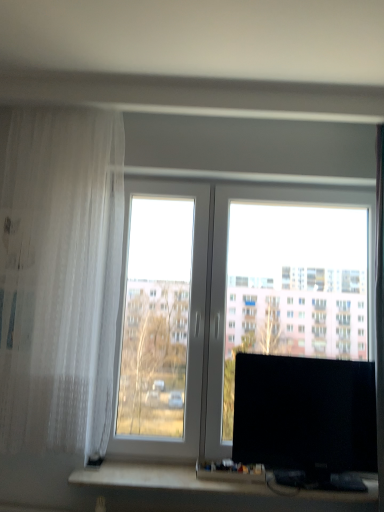
Describe the element at coordinates (59, 277) in the screenshot. The image size is (384, 512). I see `white sheer curtain at left` at that location.

Identify the location of transparent glass window at center. (286, 281).

At what (x,y) coordinates should I click in order to perform the action: click on white sheer curtain at left. Please return your answer as a coordinate pair (x, y). The height and width of the screenshot is (512, 384). Looking at the image, I should click on (59, 277).

How different are the orientations of transparent glass window at center and black glossy monitor at right in degrees?

The facing directions of transparent glass window at center and black glossy monitor at right are 0.000112 degrees apart.

Looking at the image, does transparent glass window at center seem bigger or smaller compared to black glossy monitor at right?

transparent glass window at center is bigger than black glossy monitor at right.

Is transparent glass window at center thinner than black glossy monitor at right?

Yes.

Could you tell me if transparent glass window at center is turned towards black glossy monitor at right?

Yes, transparent glass window at center is facing black glossy monitor at right.

From the image's perspective, is black glossy monitor at right under transparent glass window at center?

Indeed, from the image's perspective, black glossy monitor at right is shown beneath transparent glass window at center.

Which is less distant, (362,445) or (266,201)?

The point (362,445) is closer to the camera.

From a real-world perspective, relative to transparent glass window at center, is black glossy monitor at right vertically above or below?

Clearly, from a real-world perspective, black glossy monitor at right is below transparent glass window at center.

Is there a large distance between black glossy monitor at right and transparent glass window at center?

That's not correct — black glossy monitor at right is a little close to transparent glass window at center.

Between white sheer curtain at left and black plastic computer desk at lower center, which one appears on the left side from the viewer's perspective?

white sheer curtain at left is more to the left.

Can you confirm if white sheer curtain at left is smaller than black plastic computer desk at lower center?

Actually, white sheer curtain at left might be larger than black plastic computer desk at lower center.

Looking at their sizes, would you say white sheer curtain at left is wider or thinner than black plastic computer desk at lower center?

Considering their sizes, white sheer curtain at left looks broader than black plastic computer desk at lower center.

Consider the image. From the image's perspective, which is above, white sheer curtain at left or black plastic computer desk at lower center?

From the image's view, white sheer curtain at left is above.

Is black plastic computer desk at lower center not within transparent glass window at center?

Absolutely, black plastic computer desk at lower center is external to transparent glass window at center.

Is black plastic computer desk at lower center turned away from transparent glass window at center?

black plastic computer desk at lower center is not turned away from transparent glass window at center.

In the scene shown: Is black plastic computer desk at lower center taller or shorter than transparent glass window at center?

Considering their sizes, black plastic computer desk at lower center has less height than transparent glass window at center.

Looking at the image, does black plastic computer desk at lower center seem bigger or smaller compared to transparent glass window at center?

Considering their sizes, black plastic computer desk at lower center takes up less space than transparent glass window at center.

In terms of size, does black glossy monitor at right appear bigger or smaller than white sheer curtain at left?

black glossy monitor at right is smaller than white sheer curtain at left.

Is black glossy monitor at right far away from white sheer curtain at left?

black glossy monitor at right is near white sheer curtain at left, not far away.

Which object is more forward, black glossy monitor at right or white sheer curtain at left?

white sheer curtain at left is closer to the camera.

Is black glossy monitor at right turned away from white sheer curtain at left?

No, white sheer curtain at left is not at the back of black glossy monitor at right.

From a real-world perspective, is black glossy monitor at right physically below black plastic computer desk at lower center?

Actually, black glossy monitor at right is physically above black plastic computer desk at lower center in the real world.

Is black glossy monitor at right outside of black plastic computer desk at lower center?

black glossy monitor at right lies outside black plastic computer desk at lower center's area.

Locate an element on the screen. computer desk behind the black glossy monitor at right is located at coordinates (209, 486).

Is black glossy monitor at right taller than black plastic computer desk at lower center?

Yes, black glossy monitor at right is taller than black plastic computer desk at lower center.

Is white sheer curtain at left far from black glossy monitor at right?

That's not correct — white sheer curtain at left is a little close to black glossy monitor at right.

Does point (43, 111) come in front of point (346, 438)?

Yes, point (43, 111) is in front of point (346, 438).

Between white sheer curtain at left and black glossy monitor at right, which one has less height?

black glossy monitor at right.

Is white sheer curtain at left oriented towards black glossy monitor at right?

No, white sheer curtain at left does not turn towards black glossy monitor at right.

What are the coordinates of `computer monitor below the transparent glass window at center (from a real-world perspective)` in the screenshot? It's located at (306, 419).

Locate an element on the screen. Image resolution: width=384 pixels, height=512 pixels. window on the left of black glossy monitor at right is located at coordinates (286, 281).

Which object lies further to the anchor point black plastic computer desk at lower center, black glossy monitor at right or transparent glass window at center?

transparent glass window at center is positioned further to the anchor black plastic computer desk at lower center.

Which object lies nearer to the anchor point white sheer curtain at left, black glossy monitor at right or transparent glass window at center?

Among the two, transparent glass window at center is located nearer to white sheer curtain at left.

Estimate the real-world distances between objects in this image. Which object is further from white sheer curtain at left, transparent glass window at center or black glossy monitor at right?

Among the two, black glossy monitor at right is located further to white sheer curtain at left.

Based on their spatial positions, is black plastic computer desk at lower center or transparent glass window at center further from white sheer curtain at left?

black plastic computer desk at lower center.

Considering their positions, is black plastic computer desk at lower center positioned closer to transparent glass window at center than black glossy monitor at right?

Based on the image, black glossy monitor at right appears to be nearer to transparent glass window at center.

When comparing their distances from black glossy monitor at right, does transparent glass window at center or white sheer curtain at left seem closer?

The object closer to black glossy monitor at right is transparent glass window at center.

Looking at the image, which one is located closer to white sheer curtain at left, black glossy monitor at right or black plastic computer desk at lower center?

black plastic computer desk at lower center is positioned closer to the anchor white sheer curtain at left.

Estimate the real-world distances between objects in this image. Which object is closer to black glossy monitor at right, white sheer curtain at left or transparent glass window at center?

The object closer to black glossy monitor at right is transparent glass window at center.

You are a GUI agent. You are given a task and a screenshot of the screen. Output one action in this format:
    pyautogui.click(x=<x>, y=<y>)
    Task: Click on the window located between white sheer curtain at left and black glossy monitor at right in the left-right direction
    The image size is (384, 512).
    Given the screenshot: What is the action you would take?
    pyautogui.click(x=286, y=281)

Locate an element on the screen. The height and width of the screenshot is (512, 384). computer desk located between white sheer curtain at left and black glossy monitor at right in the left-right direction is located at coordinates (209, 486).

Locate an element on the screen. This screenshot has height=512, width=384. computer monitor between transparent glass window at center and black plastic computer desk at lower center in the vertical direction is located at coordinates (306, 419).

Where is `window between white sheer curtain at left and black plastic computer desk at lower center from top to bottom`? Image resolution: width=384 pixels, height=512 pixels. window between white sheer curtain at left and black plastic computer desk at lower center from top to bottom is located at coordinates (286, 281).